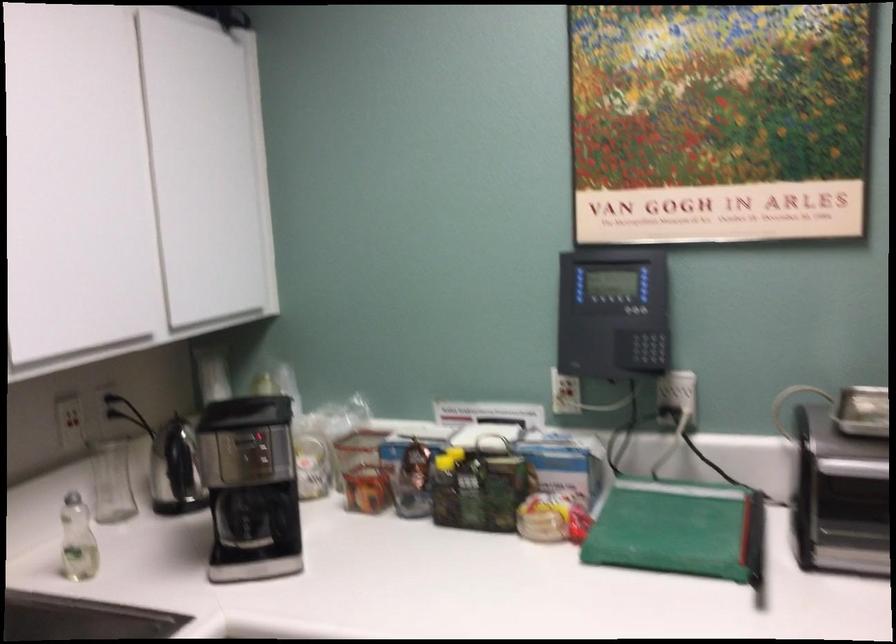
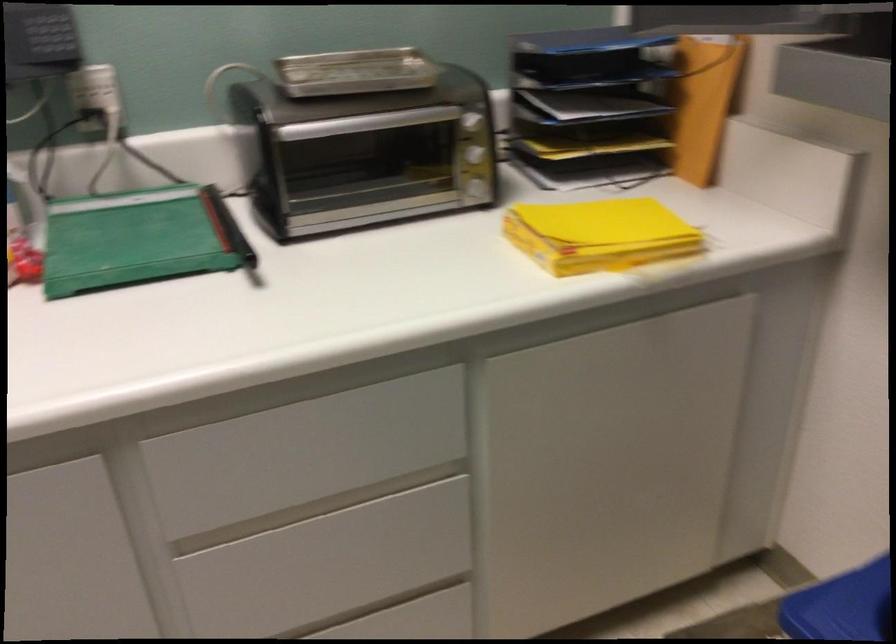
The first image is from the beginning of the video and the second image is from the end. How did the camera likely rotate when shooting the video?

The rotation direction of the camera is right-down.